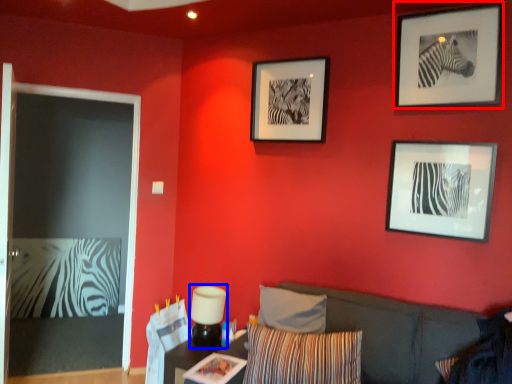
Question: Which of the following is the closest to the observer, picture frame (highlighted by a red box) or lamp (highlighted by a blue box)?

Choices:
 (A) picture frame
 (B) lamp

Answer: (A)